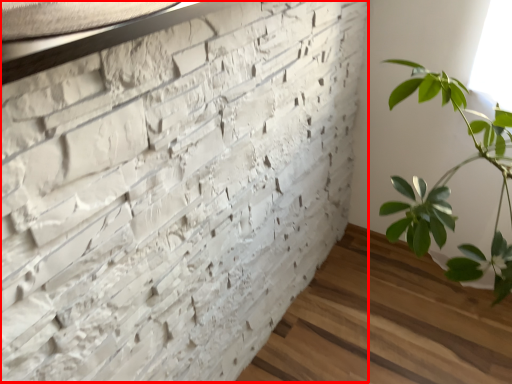
Question: From the image's perspective, where is brickwork (annotated by the red box) located relative to window sill?

Choices:
 (A) above
 (B) below

Answer: (B)